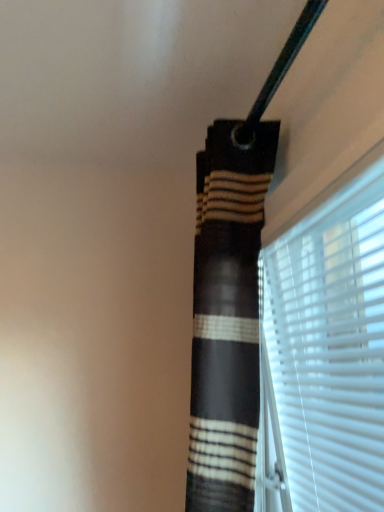
The image size is (384, 512). I want to click on white plastic blinds at right, so click(325, 351).

From the picture: Measure the distance between white plastic blinds at right and camera.

The depth of white plastic blinds at right is 20.70 inches.

What do you see at coordinates (325, 351) in the screenshot?
I see `white plastic blinds at right` at bounding box center [325, 351].

Where is `white plastic blinds at right`? white plastic blinds at right is located at coordinates (325, 351).